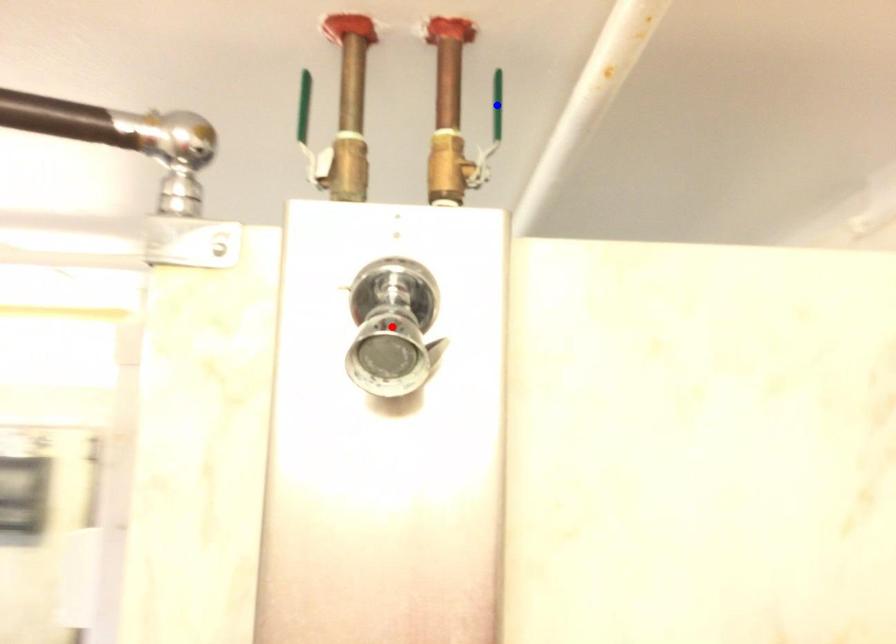
Question: Which of the two points in the image is closer to the camera?

Choices:
 (A) Blue point is closer.
 (B) Red point is closer.

Answer: (B)